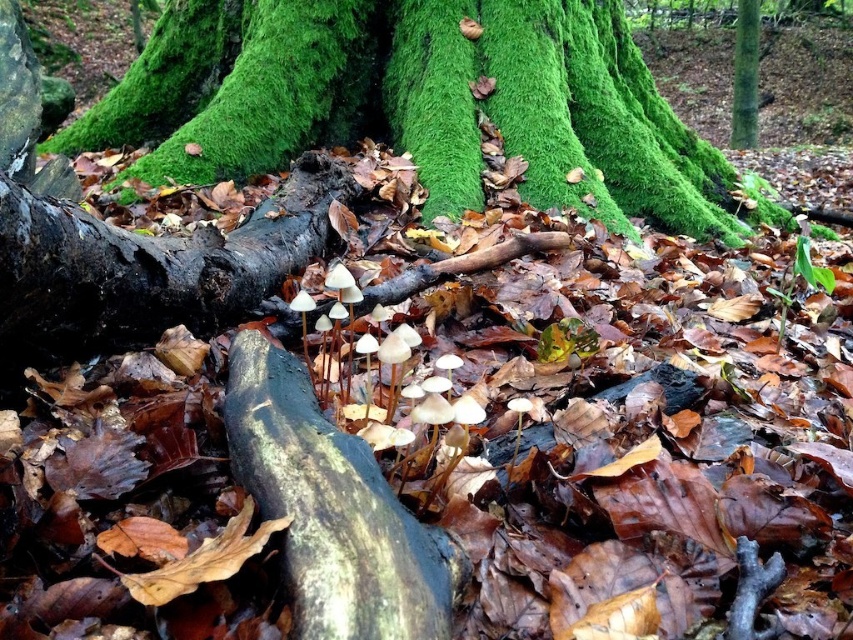
From the picture: Can you confirm if green mossy tree trunk at center is smaller than green smooth tree trunk at upper right?

No.

Is green mossy tree trunk at center above green smooth tree trunk at upper right?

Actually, green mossy tree trunk at center is below green smooth tree trunk at upper right.

I want to click on green mossy tree trunk at center, so click(x=416, y=102).